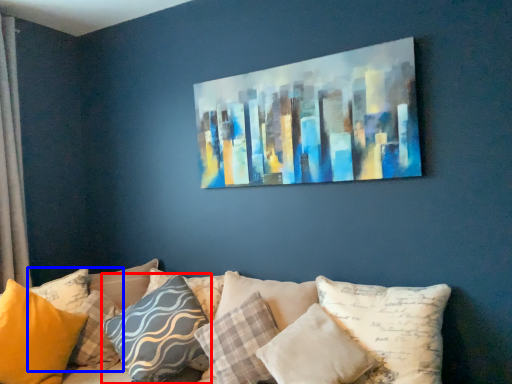
Question: Which object is further to the camera taking this photo, pillow (highlighted by a red box) or pillow (highlighted by a blue box)?

Choices:
 (A) pillow
 (B) pillow

Answer: (A)